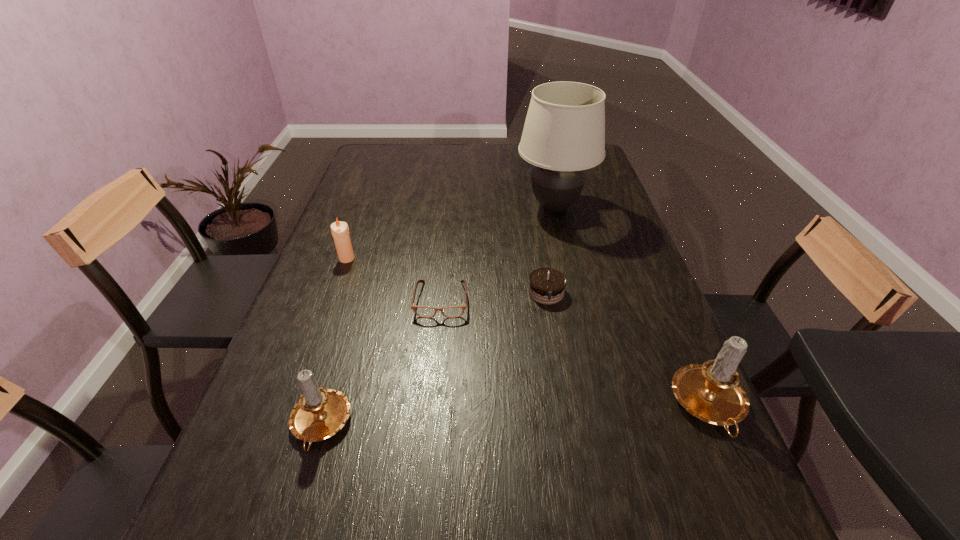
Where is `the tallest candle`? the tallest candle is located at coordinates (711, 392).

Identify the location of the second tallest object. click(711, 392).

In order to click on lampshade in this screenshot , I will do `click(564, 132)`.

Locate an element on the screen. The image size is (960, 540). the tallest object is located at coordinates (564, 132).

Where is `the fifth tallest object`? The width and height of the screenshot is (960, 540). the fifth tallest object is located at coordinates (546, 285).

Where is `the fifth nearest object`? the fifth nearest object is located at coordinates (340, 231).

Where is `spectacles`? spectacles is located at coordinates (422, 311).

The width and height of the screenshot is (960, 540). I want to click on the shortest object, so click(x=422, y=311).

The width and height of the screenshot is (960, 540). Find the location of `free space located 0.360m on the left of the rightmost candle`. free space located 0.360m on the left of the rightmost candle is located at coordinates (493, 407).

I want to click on free space located on the left of the farthest object, so click(444, 207).